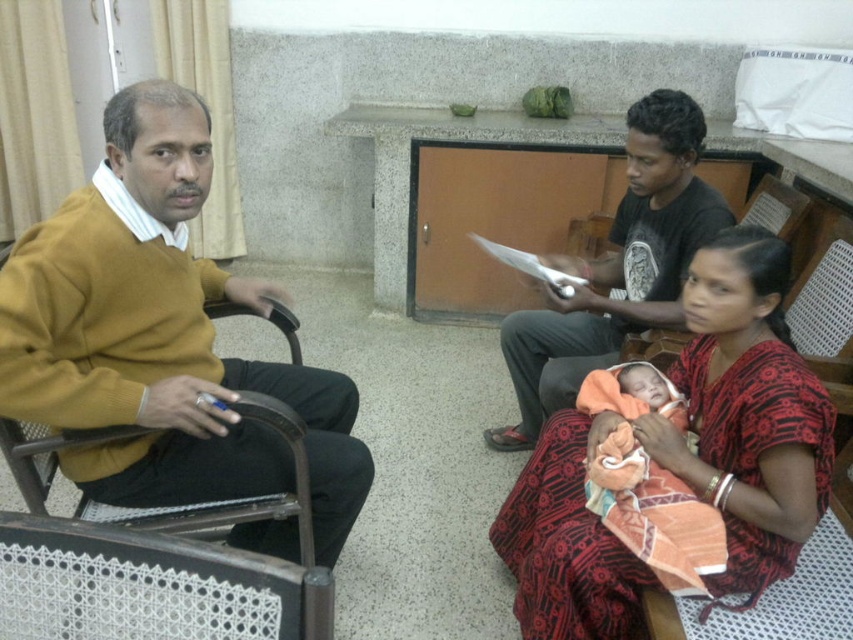
How much distance is there between mustard yellow sweater at left and red printed sari at lower right?

mustard yellow sweater at left and red printed sari at lower right are 27.89 inches apart.

Between mustard yellow sweater at left and red printed sari at lower right, which one has less height?

red printed sari at lower right is shorter.

Between point (138, 392) and point (582, 458), which one is positioned in front?

Point (138, 392) is in front.

Where is `mustard yellow sweater at left`? Image resolution: width=853 pixels, height=640 pixels. mustard yellow sweater at left is located at coordinates (160, 337).

Does point (527, 595) come in front of point (595, 342)?

Yes, point (527, 595) is closer to viewer.

Between point (700, 493) and point (675, 163), which one is positioned in front?

Point (700, 493)

Image resolution: width=853 pixels, height=640 pixels. I want to click on red printed sari at lower right, so click(746, 410).

Can you confirm if mustard yellow sweater at left is smaller than black cotton shirt at center?

Yes, mustard yellow sweater at left is smaller than black cotton shirt at center.

Which is behind, point (38, 378) or point (645, 244)?

Point (645, 244)

You are a GUI agent. You are given a task and a screenshot of the screen. Output one action in this format:
    pyautogui.click(x=<x>, y=<y>)
    Task: Click on the mustard yellow sweater at left
    This screenshot has height=640, width=853.
    Given the screenshot: What is the action you would take?
    pyautogui.click(x=160, y=337)

The height and width of the screenshot is (640, 853). Identify the location of mustard yellow sweater at left. (160, 337).